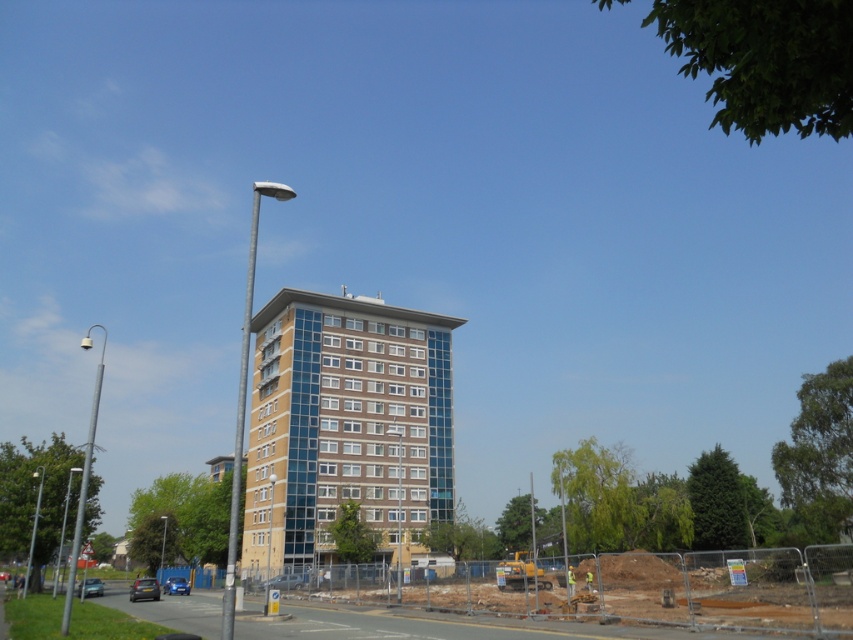
You are a delivery drone with a maximum flight altitude of 30 meters. You need to deliver a package to the brown glass building at center from the brown earth at lower center. Can you safely fly over the construction site without exceeding your altitude limit?

The distance between the brown glass building at center and brown earth at lower center is 25.87 meters. Since your maximum flight altitude is 30 meters, you can safely fly over the construction site as long as the required altitude to clear any obstacles is within the 30 meters limit. However, the provided information does not specify the height of any obstacles, so assume the path is clear.

You are standing at the origin point of the coordinate system. You need to locate the brown glass building at center. What are its coordinates?

The brown glass building at center is located at coordinates point (345, 422).

You are a delivery person trying to navigate through the area. You need to reach the brown glass building at center. Which direction should you move relative to the brown earth at lower center?

You should move towards the brown glass building at center, which is closer to you than the brown earth at lower center, so you need to move forward in the direction of the brown glass building at center.